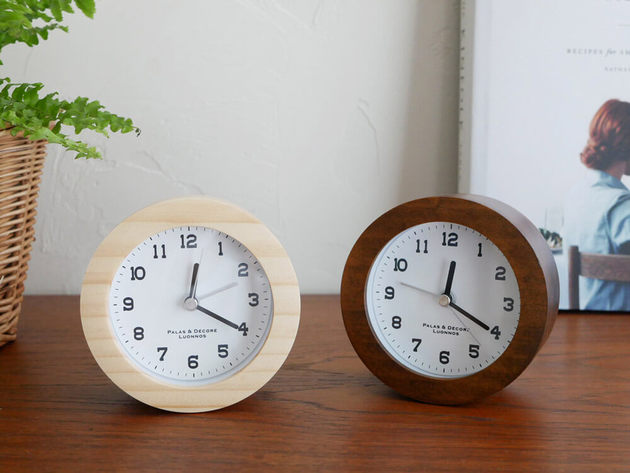
Where is `tabletop`? The image size is (630, 473). tabletop is located at coordinates (352, 377).